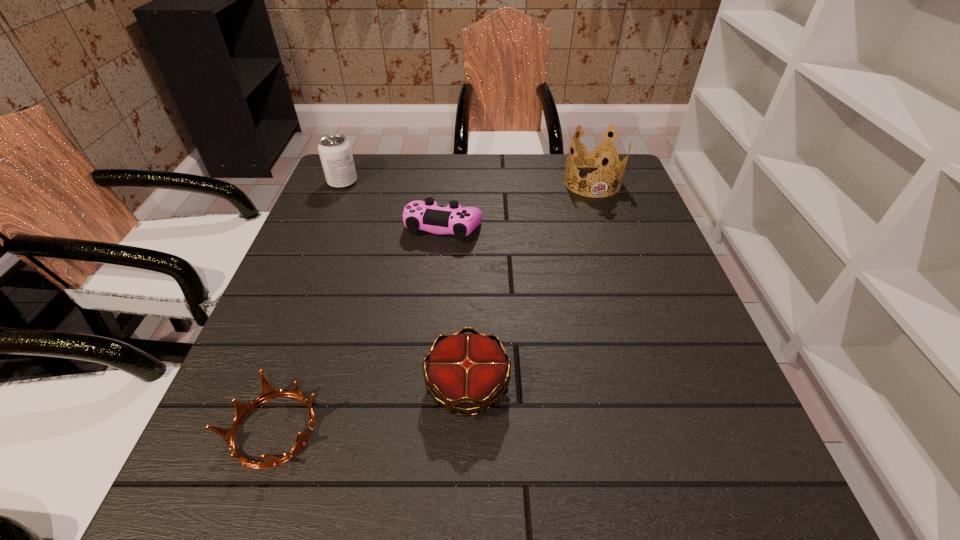
In order to click on crown object that ranks as the second closest to the leftmost crown in this screenshot , I will do 597,155.

Locate an element on the screen. The width and height of the screenshot is (960, 540). free space in the image that satisfies the following two spatial constraints: 1. on the front side of the soda can; 2. on the left side of the second tallest crown is located at coordinates pos(258,386).

I want to click on vacant position in the image that satisfies the following two spatial constraints: 1. on the front side of the second crown from right to left; 2. on the right side of the control, so click(428, 386).

Where is `free region that satisfies the following two spatial constraints: 1. on the front side of the soda can; 2. on the right side of the shortest object`? free region that satisfies the following two spatial constraints: 1. on the front side of the soda can; 2. on the right side of the shortest object is located at coordinates (240, 430).

Image resolution: width=960 pixels, height=540 pixels. I want to click on vacant area in the image that satisfies the following two spatial constraints: 1. on the front side of the second crown from left to right; 2. on the right side of the control, so click(x=428, y=386).